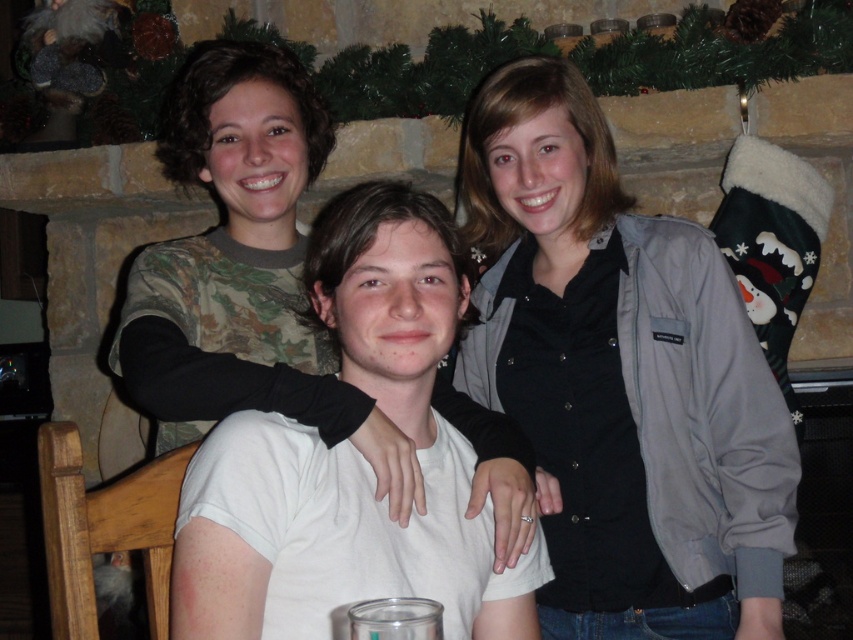
Is point (683, 499) farther from viewer compared to point (323, 598)?

Yes, it is.

Which is behind, point (631, 637) or point (537, 541)?

Positioned behind is point (631, 637).

I want to click on gray fabric jacket at upper right, so click(x=621, y=378).